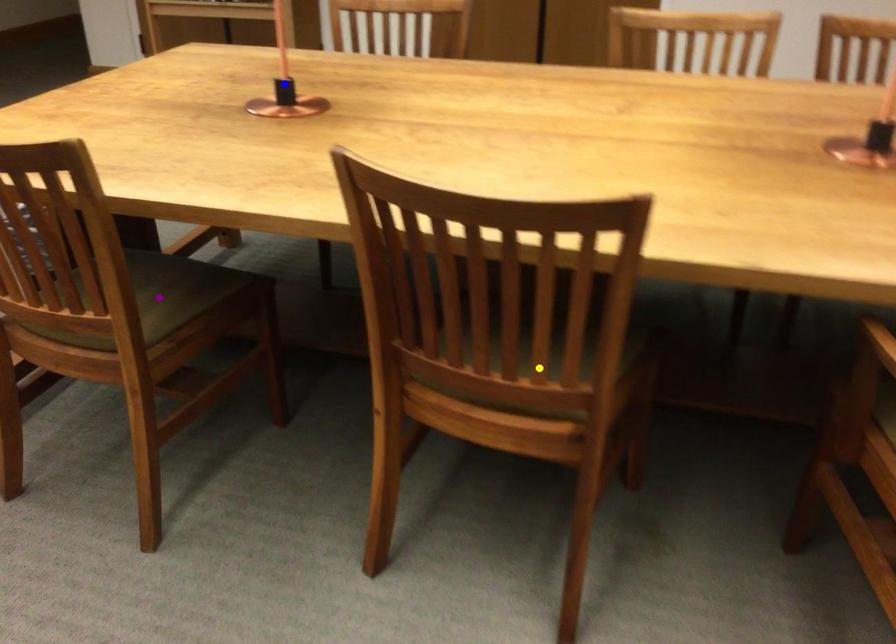
Order these from farthest to nearest:
- purple point
- yellow point
- blue point

blue point < purple point < yellow point